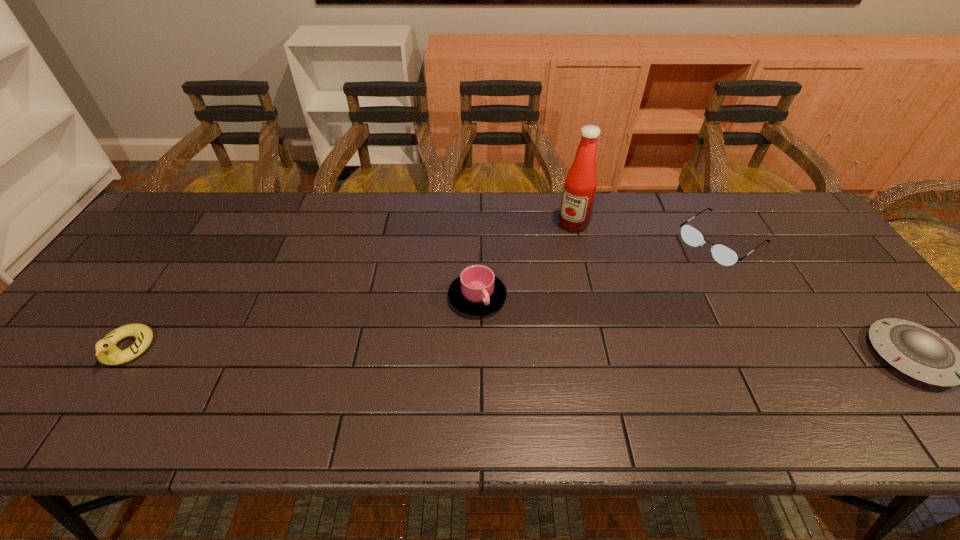
Locate an element on the screen. free spot on the desktop that is between the leftmost object and the shortest object and is positioned on the side with the handle of the third farthest object is located at coordinates (536, 353).

The image size is (960, 540). I want to click on free spot on the desktop that is between the leftmost object and the shortest object and is positioned on the front-facing side of the tallest object, so click(465, 352).

Where is `free spot on the desktop that is between the duckling and the shortest object and is positioned on the lenses of the spectacles`? free spot on the desktop that is between the duckling and the shortest object and is positioned on the lenses of the spectacles is located at coordinates (565, 353).